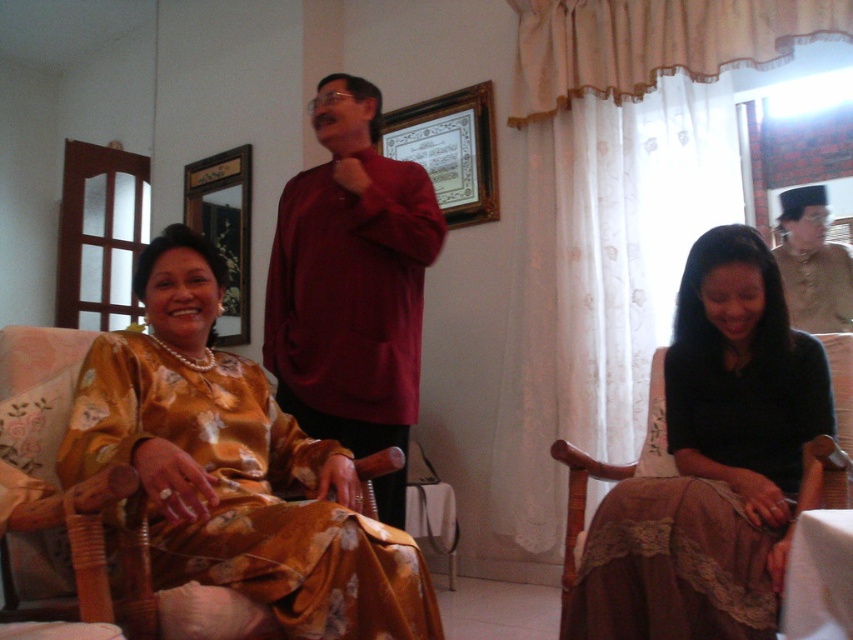
Between gold satin robe at left and matte brown robe at right, which one appears on the right side from the viewer's perspective?

matte brown robe at right

I want to click on gold satin robe at left, so click(248, 496).

Who is taller, black lace skirt at lower right or matte brown robe at right?

With more height is black lace skirt at lower right.

Is black lace skirt at lower right below matte brown robe at right?

Indeed, black lace skirt at lower right is positioned under matte brown robe at right.

Who is more distant from viewer, (750, 308) or (784, 250)?

Positioned behind is point (784, 250).

The height and width of the screenshot is (640, 853). I want to click on black lace skirt at lower right, so click(712, 464).

Is point (355, 228) positioned after point (848, 284)?

No.

Where is `matte maroon shirt at center`? This screenshot has width=853, height=640. matte maroon shirt at center is located at coordinates (350, 278).

The image size is (853, 640). I want to click on matte maroon shirt at center, so click(350, 278).